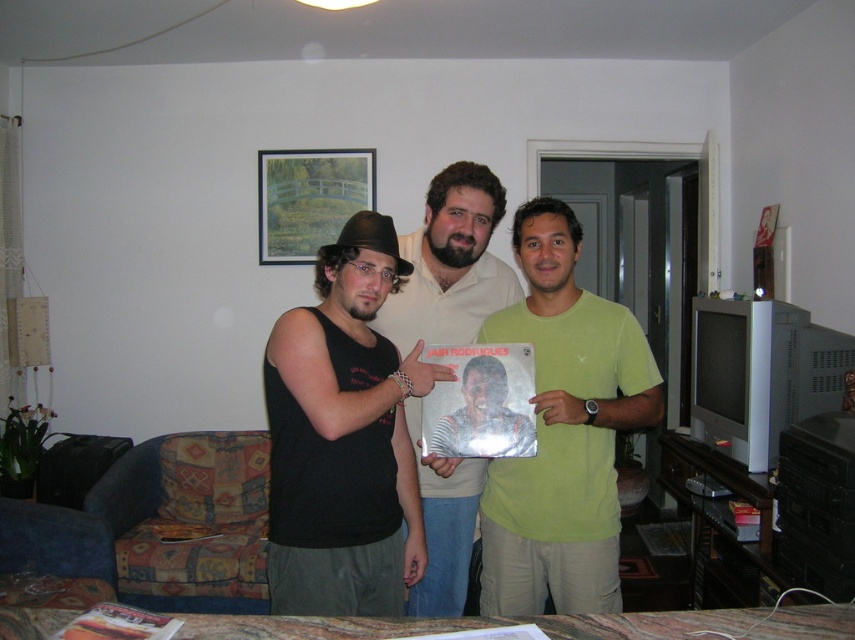
Can you confirm if black matte tank top at center is positioned to the left of green matte shirt at center?

Indeed, black matte tank top at center is positioned on the left side of green matte shirt at center.

The image size is (855, 640). Describe the element at coordinates (343, 438) in the screenshot. I see `black matte tank top at center` at that location.

Locate an element on the screen. The width and height of the screenshot is (855, 640). black matte tank top at center is located at coordinates (343, 438).

Between point (510, 364) and point (404, 273), which one is positioned behind?

Positioned behind is point (510, 364).

Does point (425, 426) lie in front of point (357, 241)?

No, it is not.

The width and height of the screenshot is (855, 640). I want to click on matte plastic photo at center, so click(481, 403).

Between black matte tank top at center and brown felt cowboy hat at center, which one is positioned higher?

brown felt cowboy hat at center is higher up.

Between point (337, 353) and point (358, 244), which one is positioned behind?

The point (358, 244) is behind.

The image size is (855, 640). What are the coordinates of `black matte tank top at center` in the screenshot? It's located at (343, 438).